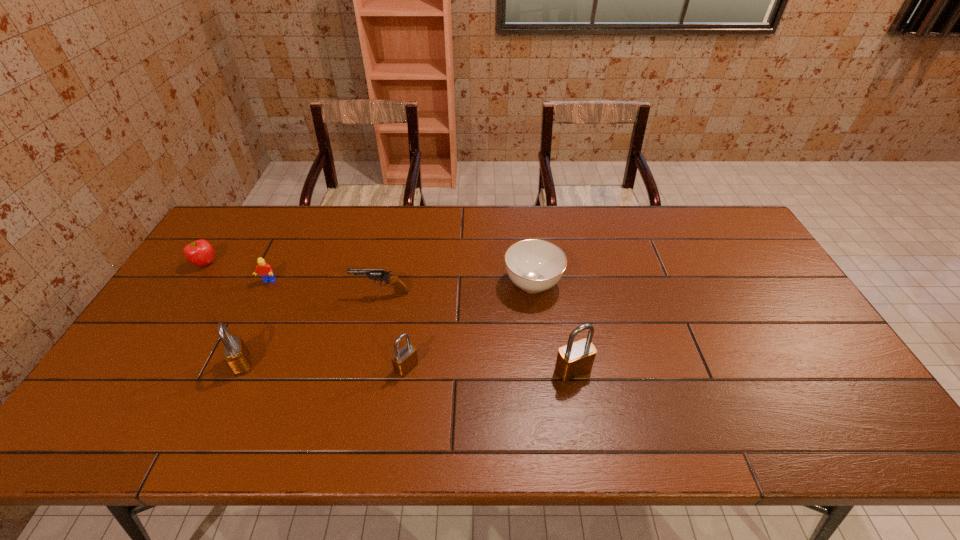
Identify the location of free space that is in between the gun and the leftmost padlock. Image resolution: width=960 pixels, height=540 pixels. (311, 329).

Find the location of a particular element. The width and height of the screenshot is (960, 540). free area in between the chinaware and the second shortest padlock is located at coordinates (388, 323).

Locate an element on the screen. free space between the apple and the leftmost padlock is located at coordinates [x=224, y=314].

At what (x,y) coordinates should I click in order to perform the action: click on free space between the rightmost padlock and the second padlock from left to right. Please return your answer as a coordinate pair (x, y). Looking at the image, I should click on (490, 368).

This screenshot has width=960, height=540. I want to click on free spot between the rightmost padlock and the leftmost object, so click(x=389, y=317).

Select which object appears as the sixth closest to the rightmost padlock. Please provide its 2D coordinates. Your answer should be formatted as a tuple, i.e. [(x, y)], where the tuple contains the x and y coordinates of a point satisfying the conditions above.

[(200, 253)]

The height and width of the screenshot is (540, 960). What are the coordinates of `the fifth closest object to the Lego` in the screenshot? It's located at (533, 265).

Find the location of a particular element. This screenshot has height=540, width=960. padlock that stands as the closest to the shortest padlock is located at coordinates (574, 359).

In order to click on the second closest padlock to the second padlock from right to left in this screenshot , I will do `click(236, 355)`.

The image size is (960, 540). In order to click on free region that satisfies the following two spatial constraints: 1. on the back side of the second tallest padlock; 2. along the barrel of the gun in this screenshot , I will do `click(275, 294)`.